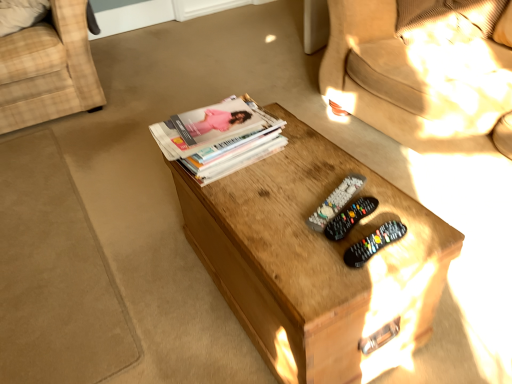
Where is `vacant space positioned to the left of wooden coffee table at center`? vacant space positioned to the left of wooden coffee table at center is located at coordinates (131, 287).